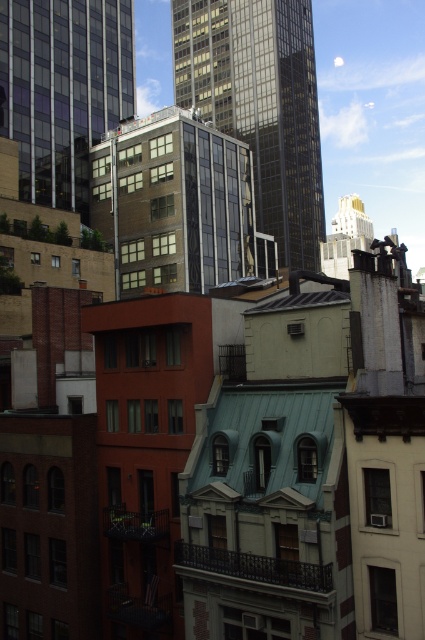
Who is shorter, green glass building at center or matte glass building at upper left?

green glass building at center

Does green glass building at center come in front of matte glass building at upper left?

No, green glass building at center is behind matte glass building at upper left.

Does point (190, 257) come behind point (48, 177)?

No, (190, 257) is closer to viewer.

Find the location of `green glass building at center`. green glass building at center is located at coordinates (176, 204).

Which is in front, point (251, 42) or point (13, 19)?

Point (13, 19)

Does glassy reflective skyscraper at center appear on the left side of matte glass building at upper left?

No, glassy reflective skyscraper at center is not to the left of matte glass building at upper left.

What are the coordinates of `glassy reflective skyscraper at center` in the screenshot? It's located at (260, 106).

Consider the image. Which is more to the right, glassy reflective skyscraper at center or green glass building at center?

glassy reflective skyscraper at center is more to the right.

Does point (271, 52) lie behind point (127, 177)?

That is True.

Image resolution: width=425 pixels, height=640 pixels. Describe the element at coordinates (260, 106) in the screenshot. I see `glassy reflective skyscraper at center` at that location.

In order to click on glassy reflective skyscraper at center in this screenshot , I will do `click(260, 106)`.